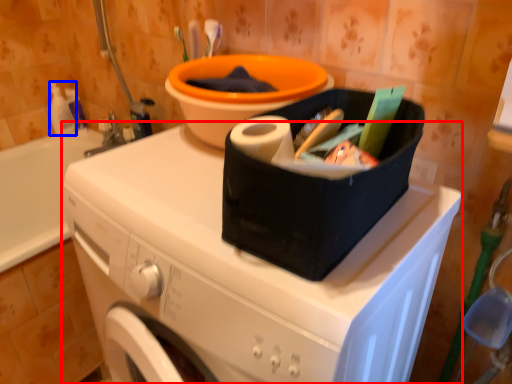
Question: Among these objects, which one is farthest to the camera, washing machine (highlighted by a red box) or cleaning product (highlighted by a blue box)?

Choices:
 (A) washing machine
 (B) cleaning product

Answer: (B)